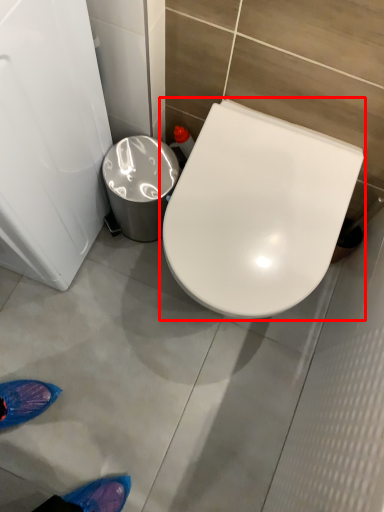
Question: From the image's perspective, what is the correct spatial positioning of toilet (annotated by the red box) in reference to trash bin/can?

Choices:
 (A) above
 (B) below

Answer: (B)